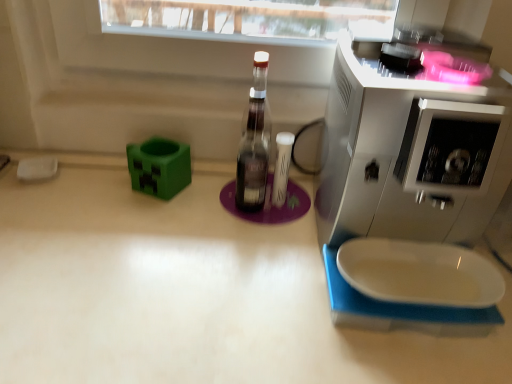
Where is `free point to the left of white glossy coffee machine at upper right`? The height and width of the screenshot is (384, 512). free point to the left of white glossy coffee machine at upper right is located at coordinates (251, 290).